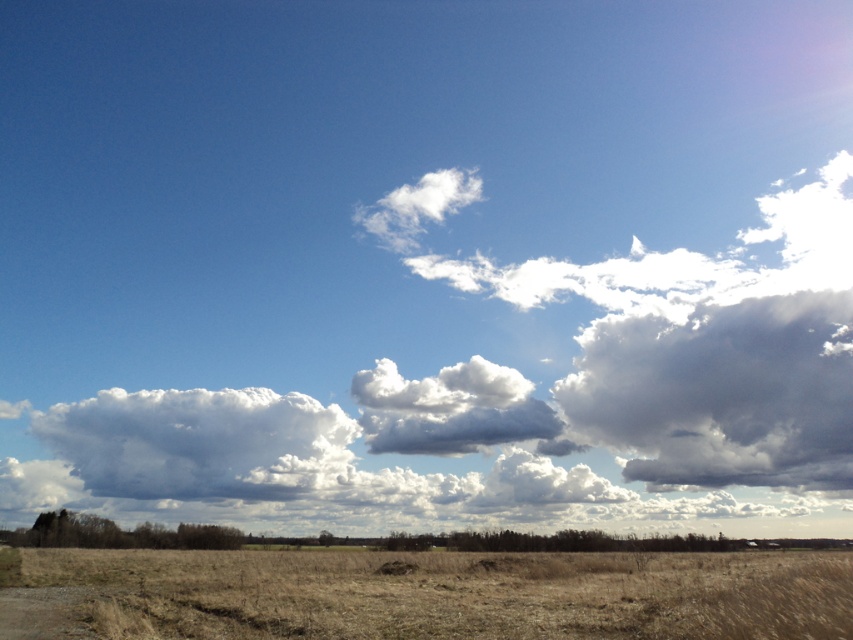
Is white fluffy cloud at upper center to the right of brown dirt track at lower left from the viewer's perspective?

Correct, you'll find white fluffy cloud at upper center to the right of brown dirt track at lower left.

Which is in front, point (761, 472) or point (7, 609)?

Positioned in front is point (7, 609).

Is point (242, 452) farther from viewer compared to point (59, 609)?

Yes, it is.

The width and height of the screenshot is (853, 640). I want to click on white fluffy cloud at upper center, so click(514, 397).

Can you confirm if cloudy gray at upper right is positioned to the right of white fluffy cloud at center?

Correct, you'll find cloudy gray at upper right to the right of white fluffy cloud at center.

Which is in front, point (746, 356) or point (64, 432)?

Point (746, 356)

Does point (693, 454) come in front of point (65, 413)?

Yes, point (693, 454) is in front of point (65, 413).

Identify the location of cloudy gray at upper right. This screenshot has height=640, width=853. (722, 392).

Is point (262, 484) farther from viewer compared to point (73, 604)?

Yes.

Can you confirm if white fluffy cloud at center is positioned above brown dirt track at lower left?

Incorrect, white fluffy cloud at center is not positioned above brown dirt track at lower left.

Identify the location of white fluffy cloud at center. The height and width of the screenshot is (640, 853). (199, 442).